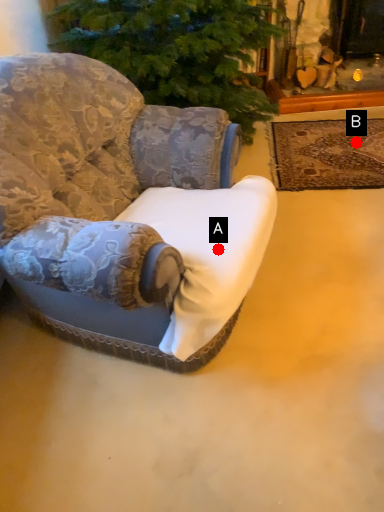
Question: Two points are circled on the image, labeled by A and B beside each circle. Which point is farther from the camera taking this photo?

Choices:
 (A) A is further
 (B) B is further

Answer: (B)